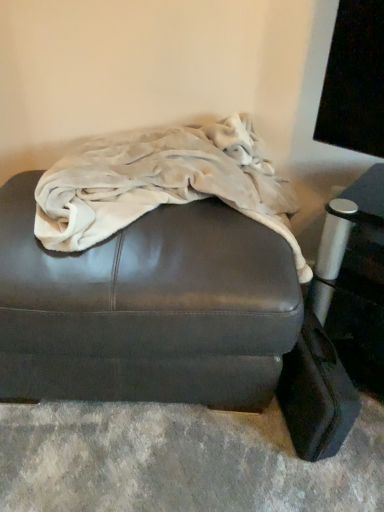
Question: Are matte brown leather ottoman at center and beige fleece blanket at center beside each other?

Choices:
 (A) yes
 (B) no

Answer: (B)

Question: Is matte brown leather ottoman at center oriented away from beige fleece blanket at center?

Choices:
 (A) yes
 (B) no

Answer: (B)

Question: Considering the relative sizes of matte brown leather ottoman at center and beige fleece blanket at center in the image provided, is matte brown leather ottoman at center bigger than beige fleece blanket at center?

Choices:
 (A) no
 (B) yes

Answer: (B)

Question: Is matte brown leather ottoman at center positioned before beige fleece blanket at center?

Choices:
 (A) no
 (B) yes

Answer: (A)

Question: Considering the relative sizes of matte brown leather ottoman at center and beige fleece blanket at center in the image provided, is matte brown leather ottoman at center taller than beige fleece blanket at center?

Choices:
 (A) yes
 (B) no

Answer: (A)

Question: From the image's perspective, would you say matte brown leather ottoman at center is shown under beige fleece blanket at center?

Choices:
 (A) no
 (B) yes

Answer: (B)

Question: Is the surface of beige fleece blanket at center in direct contact with matte brown leather ottoman at center?

Choices:
 (A) no
 (B) yes

Answer: (A)

Question: Does beige fleece blanket at center turn towards matte brown leather ottoman at center?

Choices:
 (A) yes
 (B) no

Answer: (A)

Question: Does beige fleece blanket at center have a lesser height compared to matte brown leather ottoman at center?

Choices:
 (A) yes
 (B) no

Answer: (A)

Question: Can matte brown leather ottoman at center be found inside beige fleece blanket at center?

Choices:
 (A) yes
 (B) no

Answer: (B)

Question: Does beige fleece blanket at center have a greater width compared to matte brown leather ottoman at center?

Choices:
 (A) yes
 (B) no

Answer: (B)

Question: From a real-world perspective, is beige fleece blanket at center positioned over matte brown leather ottoman at center based on gravity?

Choices:
 (A) yes
 (B) no

Answer: (A)

Question: Would you say black leather suitcase at lower right is part of beige fleece blanket at center's contents?

Choices:
 (A) yes
 (B) no

Answer: (B)